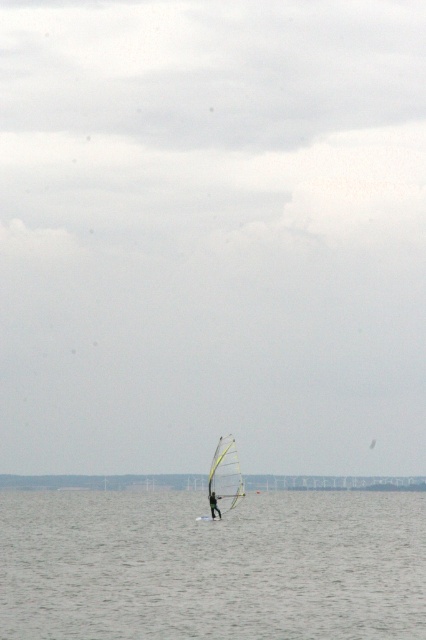
Question: Which object is farther from the camera taking this photo?

Choices:
 (A) green fabric sailboard at center
 (B) clear water at center
 (C) white matte sail at center

Answer: (A)

Question: In this image, where is clear water at center located relative to green fabric sailboard at center?

Choices:
 (A) below
 (B) above

Answer: (A)

Question: Does clear water at center have a lesser width compared to green fabric sailboard at center?

Choices:
 (A) no
 (B) yes

Answer: (A)

Question: Which object is closer to the camera taking this photo?

Choices:
 (A) clear water at center
 (B) white matte sail at center
 (C) green fabric sailboard at center

Answer: (A)

Question: Which of the following is the farthest from the observer?

Choices:
 (A) (106, 564)
 (B) (213, 496)
 (C) (221, 472)

Answer: (C)

Question: Does clear water at center have a lesser width compared to white matte sail at center?

Choices:
 (A) no
 (B) yes

Answer: (A)